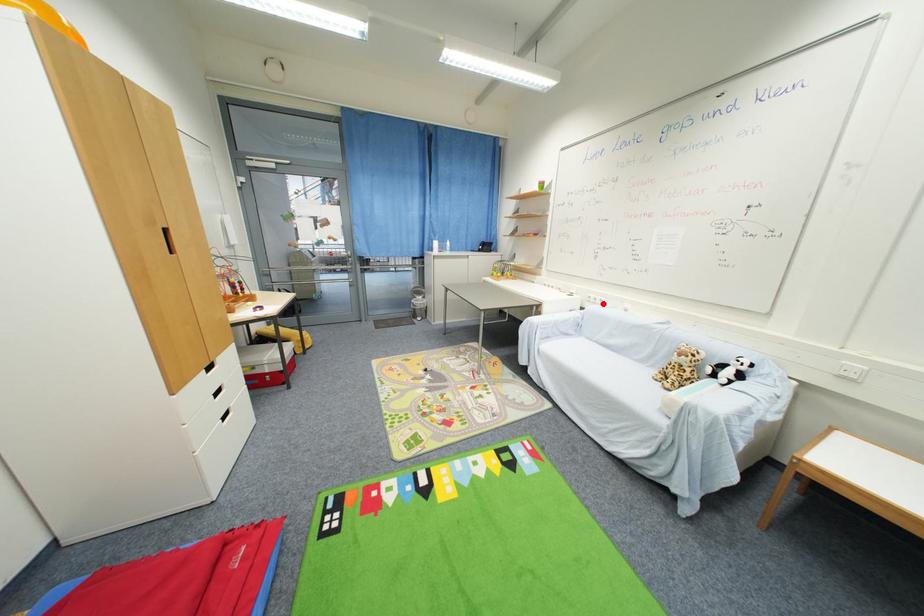
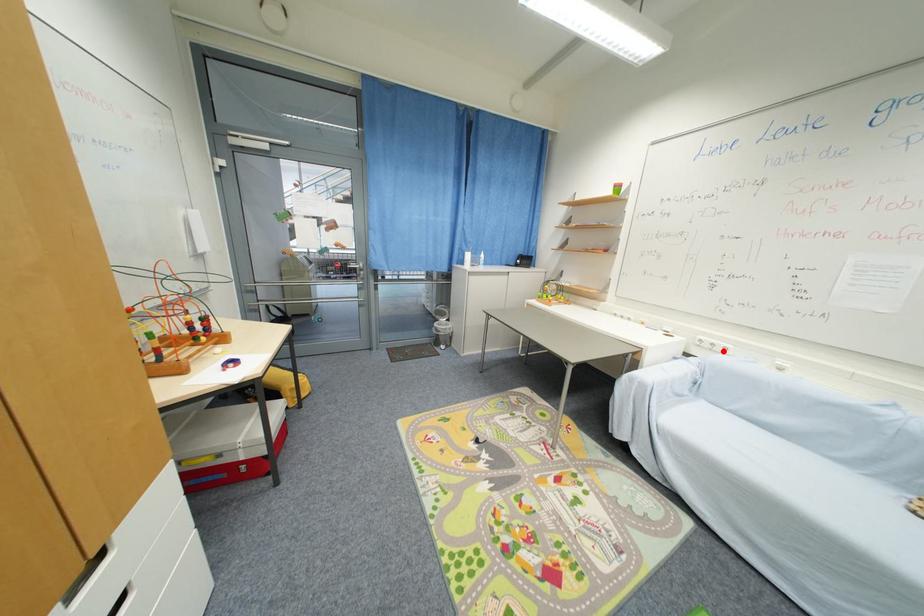
I am providing you with two images of the same scene from different viewpoints. A red point is marked on the first image and another point is marked on the second image. Do the highlighted points in image1 and image2 indicate the same real-world spot?

Yes